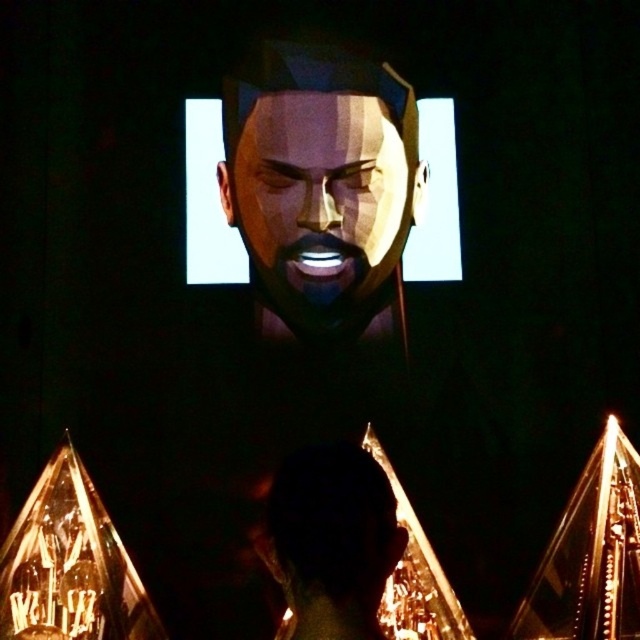
Question: Can you confirm if matte metallic face at center is bigger than black matte head at center?

Choices:
 (A) no
 (B) yes

Answer: (B)

Question: Which point appears closest to the camera in this image?

Choices:
 (A) (337, 518)
 (B) (262, 122)

Answer: (A)

Question: Is matte metallic face at center behind black matte head at center?

Choices:
 (A) yes
 (B) no

Answer: (A)

Question: Does matte metallic face at center lie behind black matte head at center?

Choices:
 (A) yes
 (B) no

Answer: (A)

Question: Among these objects, which one is nearest to the camera?

Choices:
 (A) matte metallic face at center
 (B) black matte head at center

Answer: (B)